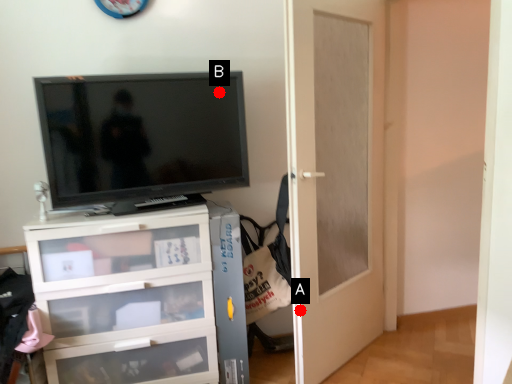
Question: Two points are circled on the image, labeled by A and B beside each circle. Which point appears closest to the camera in this image?

Choices:
 (A) A is closer
 (B) B is closer

Answer: (A)